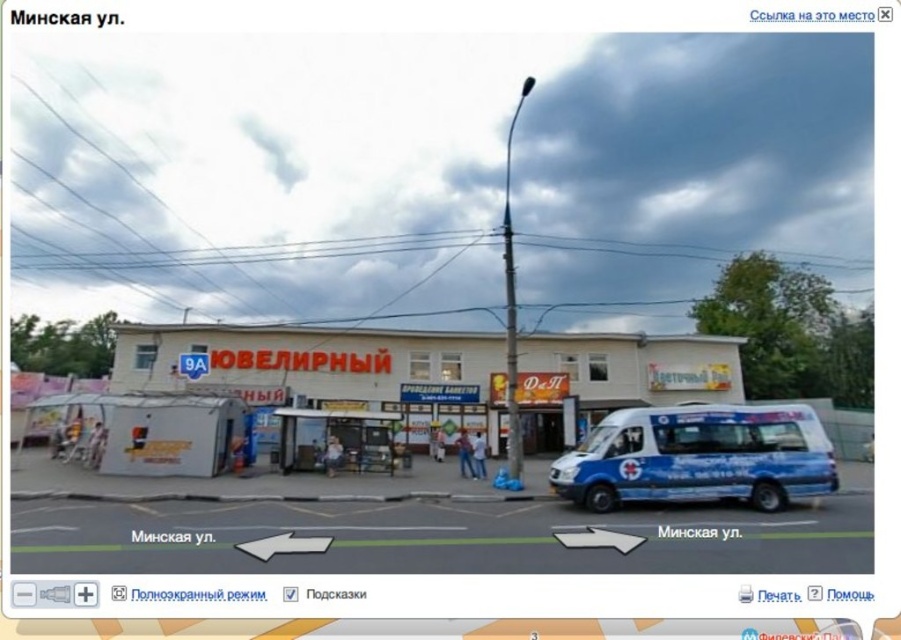
How distant is white matte building at center from blue metallic van at center?

white matte building at center and blue metallic van at center are 90.65 meters apart.

Who is more distant from viewer, (148, 353) or (615, 476)?

The point (148, 353) is behind.

The width and height of the screenshot is (901, 640). In order to click on white matte building at center in this screenshot , I will do `click(328, 365)`.

Who is taller, white matte building at center or blue metallic van at right?

white matte building at center is taller.

Who is more forward, [317,326] or [869,458]?

Point [869,458]

Locate an element on the screen. white matte building at center is located at coordinates (328, 365).

Can you confirm if blue metallic van at center is smaller than blue metallic van at right?

Incorrect, blue metallic van at center is not smaller in size than blue metallic van at right.

Who is shorter, blue metallic van at center or blue metallic van at right?

Standing shorter between the two is blue metallic van at right.

Is point (754, 438) positioned in front of point (869, 440)?

Yes.

Locate an element on the screen. Image resolution: width=901 pixels, height=640 pixels. blue metallic van at center is located at coordinates (699, 456).